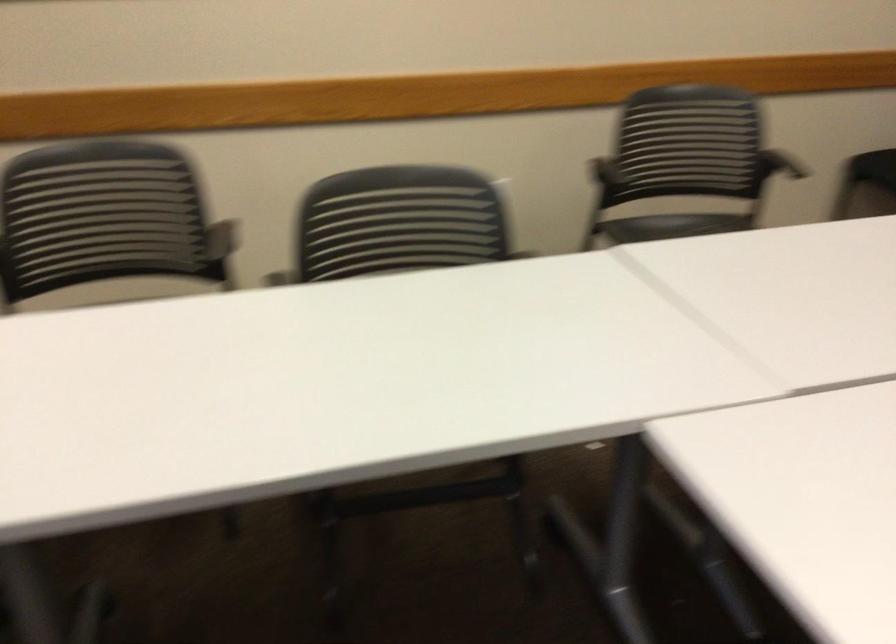
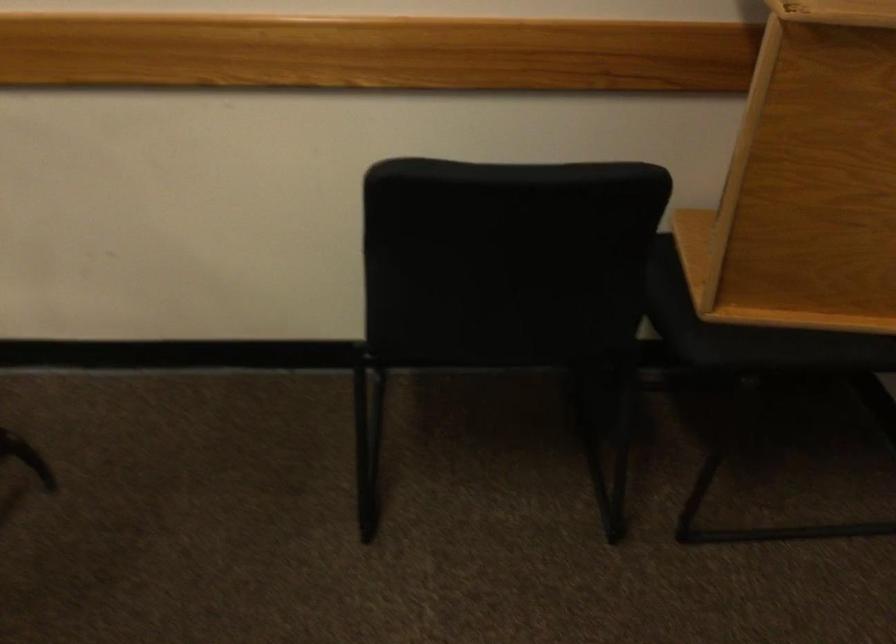
Based on the photo, the images are taken continuously from a first-person perspective. In which direction are you moving?

The cameraman moved toward right, forward.